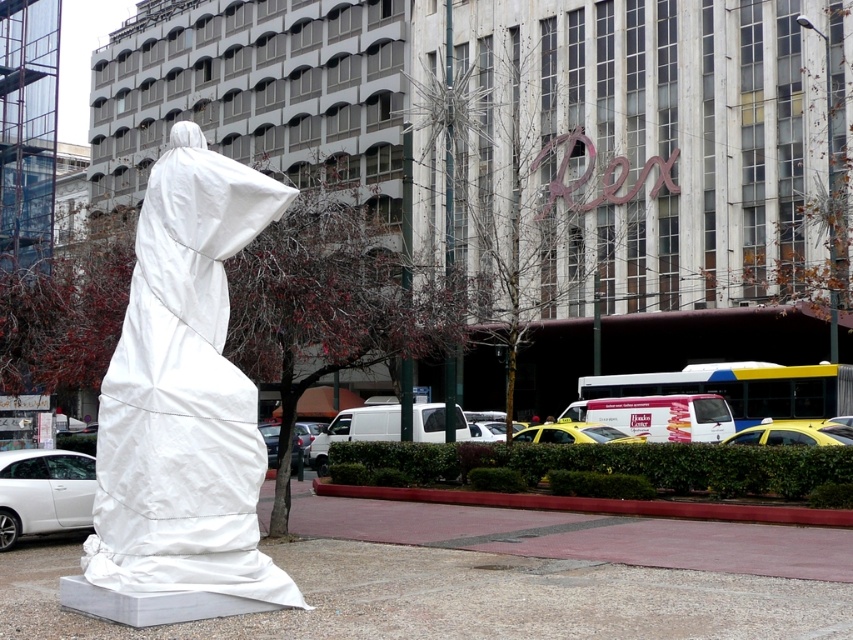
Question: Can you confirm if white fabric sculpture at left is positioned above white matte car at lower left?

Choices:
 (A) yes
 (B) no

Answer: (A)

Question: Does white fabric sculpture at left come behind yellow matte taxi at center?

Choices:
 (A) yes
 (B) no

Answer: (B)

Question: Estimate the real-world distances between objects in this image. Which object is farther from the yellow matte taxi at center?

Choices:
 (A) yellow matte taxi at lower right
 (B) white matte car at lower left
 (C) white fabric sculpture at left

Answer: (C)

Question: Does white fabric sculpture at left have a smaller size compared to yellow matte taxi at center?

Choices:
 (A) yes
 (B) no

Answer: (B)

Question: Which object is positioned closest to the white fabric sculpture at left?

Choices:
 (A) yellow matte taxi at lower right
 (B) white matte car at lower left

Answer: (B)

Question: Which point appears farthest from the camera in this image?

Choices:
 (A) (1, 468)
 (B) (595, 440)
 (C) (763, 429)

Answer: (B)